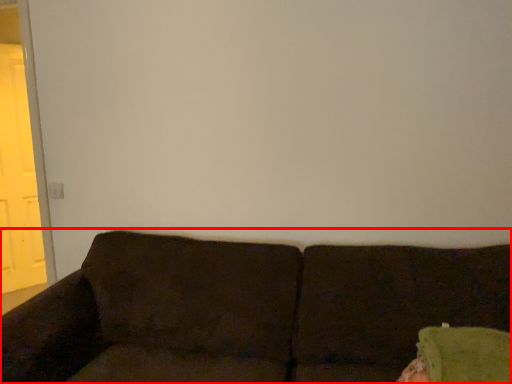
Question: From the image's perspective, where is studio couch (annotated by the red box) located relative to screen door?

Choices:
 (A) below
 (B) above

Answer: (A)